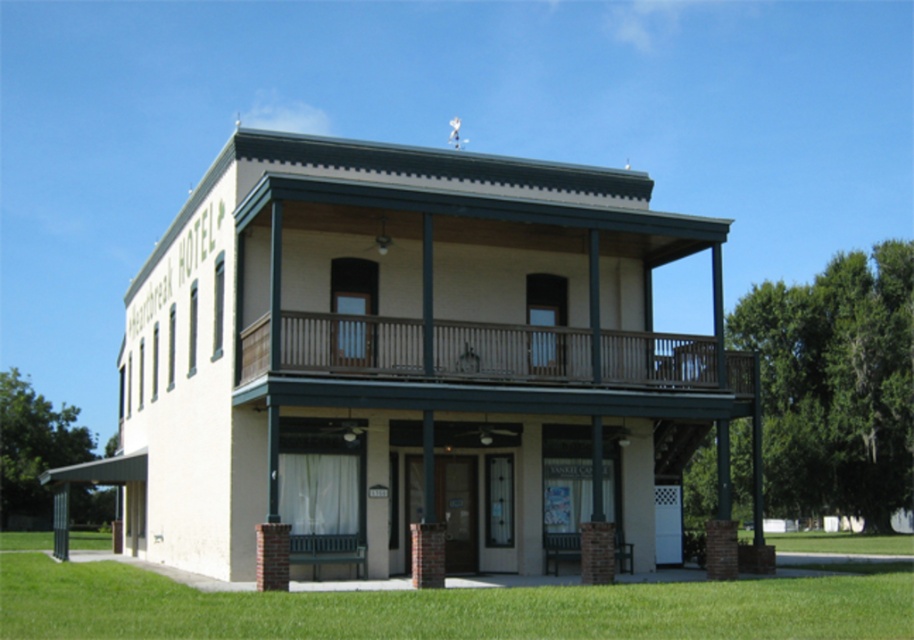
Image resolution: width=914 pixels, height=640 pixels. What do you see at coordinates (449, 608) in the screenshot? I see `green grass at lower center` at bounding box center [449, 608].

Which is more to the right, green grass at lower center or brown wooden porch at upper center?

From the viewer's perspective, brown wooden porch at upper center appears more on the right side.

Locate an element on the screen. green grass at lower center is located at coordinates (449, 608).